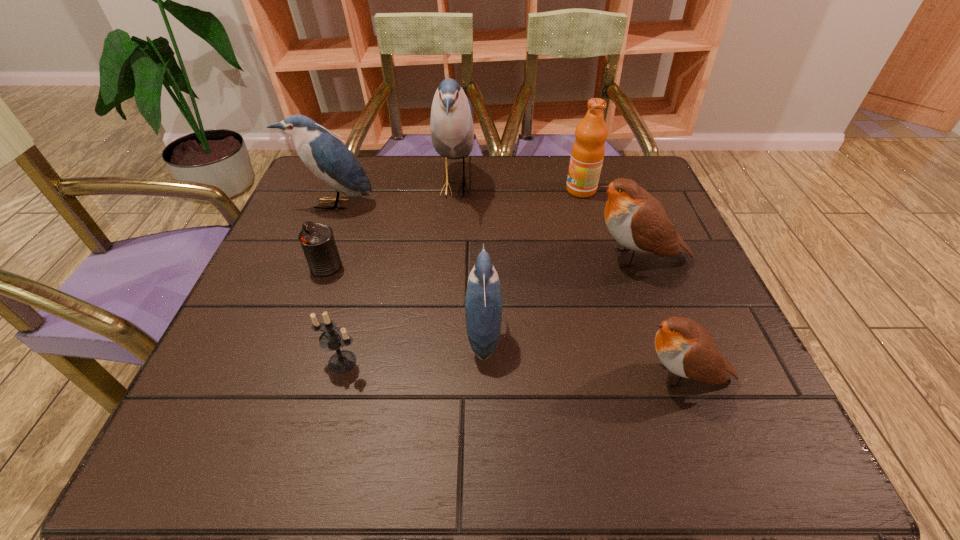
Identify the location of vacant space that is in between the shortest object and the fruit juice. (453, 228).

At what (x,y) coordinates should I click in order to perform the action: click on vacant area that lies between the tallest bird and the second smallest blue bird. Please return your answer as a coordinate pair (x, y). Image resolution: width=960 pixels, height=540 pixels. Looking at the image, I should click on (395, 195).

Where is `vacant region between the fourth shortest bird and the smallest blue bird`? The width and height of the screenshot is (960, 540). vacant region between the fourth shortest bird and the smallest blue bird is located at coordinates (409, 268).

This screenshot has width=960, height=540. In order to click on vacant point located between the candle holder and the shortest bird in this screenshot , I will do `click(513, 369)`.

At what (x,y) coordinates should I click in order to perform the action: click on free space between the smallest blue bird and the smaller brown bird. Please return your answer as a coordinate pair (x, y). The width and height of the screenshot is (960, 540). Looking at the image, I should click on (583, 355).

Image resolution: width=960 pixels, height=540 pixels. Identify the location of empty space that is in between the tallest object and the shortest bird. (568, 281).

At what (x,y) coordinates should I click in order to perform the action: click on object identified as the seventh closest to the tallest bird. Please return your answer as a coordinate pair (x, y). Image resolution: width=960 pixels, height=540 pixels. Looking at the image, I should click on (687, 349).

Find the location of a particular element. This screenshot has width=960, height=540. object that is the fifth closest to the candle holder is located at coordinates (687, 349).

Identify which bird is the second closest to the tallest object. Please provide its 2D coordinates. Your answer should be formatted as a tuple, i.e. [(x, y)], where the tuple contains the x and y coordinates of a point satisfying the conditions above.

[(636, 220)]

Find the location of a particular element. This screenshot has width=960, height=540. bird that stands as the closest to the bigger brown bird is located at coordinates (687, 349).